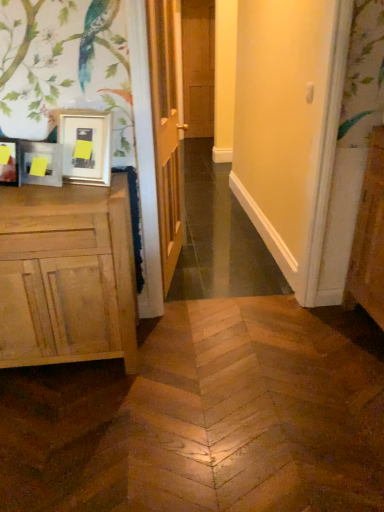
Locate an element on the screen. matte wooden picture frame at left is located at coordinates (41, 163).

From the picture: Measure the distance between point [57,150] and camera.

Point [57,150] and camera are 6.10 feet apart.

This screenshot has width=384, height=512. What do you see at coordinates (67, 275) in the screenshot?
I see `natural wood cabinet at left` at bounding box center [67, 275].

Locate an element on the screen. This screenshot has width=384, height=512. wooden door at center, acting as the 1th door starting from the front is located at coordinates (166, 133).

I want to click on matte wood screen door at center, so click(x=285, y=123).

Is natural wood cabinet at left with matte wooden picture frame at left?

natural wood cabinet at left is not next to matte wooden picture frame at left, and they're not touching.

Would you say natural wood cabinet at left contains matte wooden picture frame at left?

No, matte wooden picture frame at left is located outside of natural wood cabinet at left.

Is point (26, 249) behind point (42, 184)?

No, (26, 249) is in front of (42, 184).

From a real-world perspective, which is physically below, natural wood cabinet at left or matte wooden picture frame at left?

natural wood cabinet at left.

Is point (24, 206) farther from viewer compared to point (203, 132)?

No, (24, 206) is in front of (203, 132).

Is natural wood cabinet at left smaller than brown wooden door at center, the 1th door viewed from the top?

No.

Is natural wood cabinet at left in contact with brown wooden door at center, which is the second door in bottom-to-top order?

natural wood cabinet at left and brown wooden door at center, which is the second door in bottom-to-top order, are not in contact.

Does wooden door at center, marked as the second door in a back-to-front arrangement, have a lesser width compared to matte wooden picture frame at left?

In fact, wooden door at center, marked as the second door in a back-to-front arrangement, might be wider than matte wooden picture frame at left.

Considering the relative positions of wooden door at center, positioned as the 1th door in bottom-to-top order, and matte wooden picture frame at left in the image provided, is wooden door at center, positioned as the 1th door in bottom-to-top order, to the right of matte wooden picture frame at left from the viewer's perspective?

Yes.

Between wooden door at center, positioned as the 1th door in bottom-to-top order, and matte wooden picture frame at left, which one is positioned in front?

matte wooden picture frame at left is closer to the camera.

Between point (149, 38) and point (26, 152), which one is positioned in front?

Point (26, 152)

Considering their positions, is matte wood screen door at center located in front of or behind wooden door at center, acting as the 1th door starting from the front?

matte wood screen door at center is in front of wooden door at center, acting as the 1th door starting from the front.

Is point (265, 176) in front of point (162, 65)?

No, (265, 176) is behind (162, 65).

Considering the relative sizes of matte wood screen door at center and wooden door at center, marked as the second door in a back-to-front arrangement, in the image provided, is matte wood screen door at center wider than wooden door at center, marked as the second door in a back-to-front arrangement,?

Indeed, matte wood screen door at center has a greater width compared to wooden door at center, marked as the second door in a back-to-front arrangement.

Is matte wood screen door at center beside wooden door at center, placed as the second door when sorted from top to bottom?

matte wood screen door at center and wooden door at center, placed as the second door when sorted from top to bottom, are not in contact.

Which is nearer, (x=292, y=2) or (x=192, y=38)?

Point (x=292, y=2)

Can brown wooden door at center, which is the second door in bottom-to-top order, be found inside matte wood screen door at center?

That's incorrect, brown wooden door at center, which is the second door in bottom-to-top order, is not inside matte wood screen door at center.

Considering the relative sizes of matte wood screen door at center and brown wooden door at center, marked as the 2th door in a front-to-back arrangement, in the image provided, is matte wood screen door at center taller than brown wooden door at center, marked as the 2th door in a front-to-back arrangement,?

Incorrect, the height of matte wood screen door at center is not larger of that of brown wooden door at center, marked as the 2th door in a front-to-back arrangement.

Is matte wood screen door at center oriented away from brown wooden door at center, marked as the 2th door in a front-to-back arrangement?

Absolutely, matte wood screen door at center is directed away from brown wooden door at center, marked as the 2th door in a front-to-back arrangement.

Looking at this image, from the image's perspective, which one is positioned lower, matte wooden picture frame at left or brown wooden door at center, the 1th door viewed from the top?

matte wooden picture frame at left, from the image's perspective.

Looking at this image, from a real-world perspective, is matte wooden picture frame at left positioned above or below brown wooden door at center, acting as the 1th door starting from the back?

In terms of real-world spatial position, matte wooden picture frame at left is below brown wooden door at center, acting as the 1th door starting from the back.

How much distance is there between matte wooden picture frame at left and brown wooden door at center, the 1th door viewed from the top?

matte wooden picture frame at left is 4.29 meters away from brown wooden door at center, the 1th door viewed from the top.

Is matte wooden picture frame at left far from brown wooden door at center, acting as the 1th door starting from the back?

Yes.

Considering the sizes of objects matte wood screen door at center and natural wood cabinet at left in the image provided, who is shorter, matte wood screen door at center or natural wood cabinet at left?

natural wood cabinet at left is shorter.

Between matte wood screen door at center and natural wood cabinet at left, which one appears on the right side from the viewer's perspective?

Positioned to the right is matte wood screen door at center.

Considering the sizes of matte wood screen door at center and natural wood cabinet at left in the image, is matte wood screen door at center bigger or smaller than natural wood cabinet at left?

In the image, matte wood screen door at center appears to be smaller than natural wood cabinet at left.

This screenshot has height=512, width=384. What are the coordinates of `cabinetry directly beneath the matte wooden picture frame at left (from a real-world perspective)` in the screenshot? It's located at (67, 275).

In the image, there is a brown wooden door at center, which is the second door in bottom-to-top order. Where is `cabinetry below it (from the image's perspective)`? The image size is (384, 512). cabinetry below it (from the image's perspective) is located at coordinates (67, 275).

When comparing their distances from wooden door at center, marked as the second door in a back-to-front arrangement, does matte wood screen door at center or matte wooden picture frame at left seem further?

matte wood screen door at center lies further to wooden door at center, marked as the second door in a back-to-front arrangement, than the other object.

Which object lies nearer to the anchor point matte wood screen door at center, matte wooden picture frame at left or wooden door at center, marked as the second door in a back-to-front arrangement?

wooden door at center, marked as the second door in a back-to-front arrangement, is positioned closer to the anchor matte wood screen door at center.

Based on their spatial positions, is matte wooden picture frame at left or natural wood cabinet at left closer to brown wooden door at center, which is the second door in bottom-to-top order?

matte wooden picture frame at left.

From the image, which object appears to be farther from matte wood screen door at center, natural wood cabinet at left or matte wooden picture frame at left?

Based on the image, matte wooden picture frame at left appears to be further to matte wood screen door at center.

Estimate the real-world distances between objects in this image. Which object is further from brown wooden door at center, acting as the 1th door starting from the back, matte wooden picture frame at left or matte wood screen door at center?

matte wooden picture frame at left is positioned further to the anchor brown wooden door at center, acting as the 1th door starting from the back.

Looking at the image, which one is located further to brown wooden door at center, marked as the 2th door in a front-to-back arrangement, wooden door at center, marked as the second door in a back-to-front arrangement, or natural wood cabinet at left?

Based on the image, natural wood cabinet at left appears to be further to brown wooden door at center, marked as the 2th door in a front-to-back arrangement.

Considering their positions, is wooden door at center, acting as the 1th door starting from the front, positioned closer to natural wood cabinet at left than matte wooden picture frame at left?

matte wooden picture frame at left.

Which object lies further to the anchor point matte wood screen door at center, matte wooden picture frame at left or natural wood cabinet at left?

The object further to matte wood screen door at center is matte wooden picture frame at left.

Identify the location of picture frame between wooden door at center, acting as the 1th door starting from the front, and natural wood cabinet at left, in the vertical direction. (41, 163).

This screenshot has height=512, width=384. Identify the location of door between matte wood screen door at center and brown wooden door at center, acting as the 1th door starting from the back, along the z-axis. (166, 133).

Where is `screen door positioned between natural wood cabinet at left and brown wooden door at center, acting as the 1th door starting from the back, from near to far`? screen door positioned between natural wood cabinet at left and brown wooden door at center, acting as the 1th door starting from the back, from near to far is located at coordinates (285, 123).

You are a GUI agent. You are given a task and a screenshot of the screen. Output one action in this format:
    pyautogui.click(x=<x>, y=<y>)
    Task: Click on the picture frame located between matte wood screen door at center and brown wooden door at center, the 1th door viewed from the top, in the depth direction
    
    Given the screenshot: What is the action you would take?
    pyautogui.click(x=41, y=163)